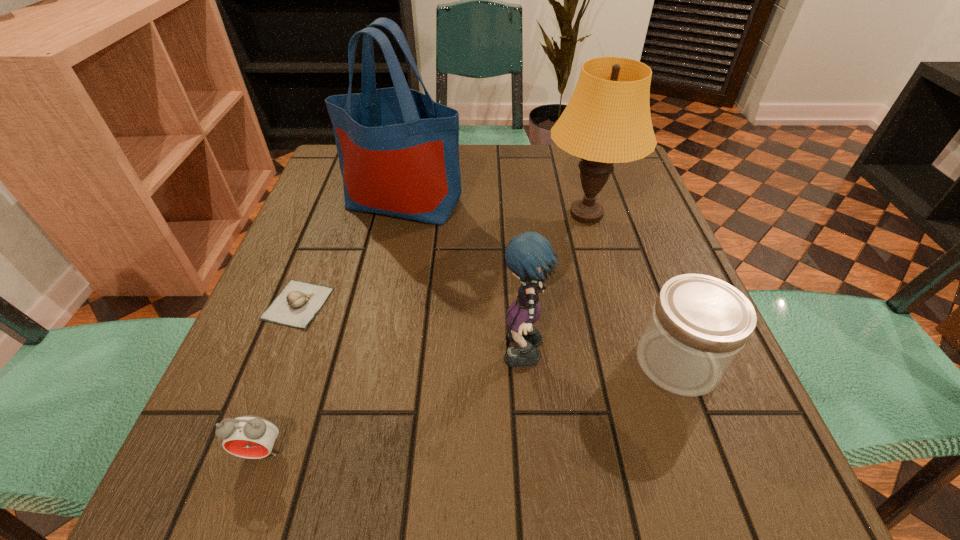
Locate an element on the screen. This screenshot has height=540, width=960. object that can be found as the third closest to the rag doll is located at coordinates (398, 150).

This screenshot has height=540, width=960. I want to click on free spot that satisfies the following two spatial constraints: 1. on the front-facing side of the rag doll; 2. on the back side of the jar, so click(x=524, y=362).

This screenshot has height=540, width=960. What are the coordinates of `vacant space that satisfies the following two spatial constraints: 1. on the front-facing side of the fourth shortest object; 2. on the face of the nearest object` in the screenshot? It's located at (532, 451).

The height and width of the screenshot is (540, 960). I want to click on free point that satisfies the following two spatial constraints: 1. on the back side of the shortest object; 2. on the right side of the second tallest object, so click(333, 214).